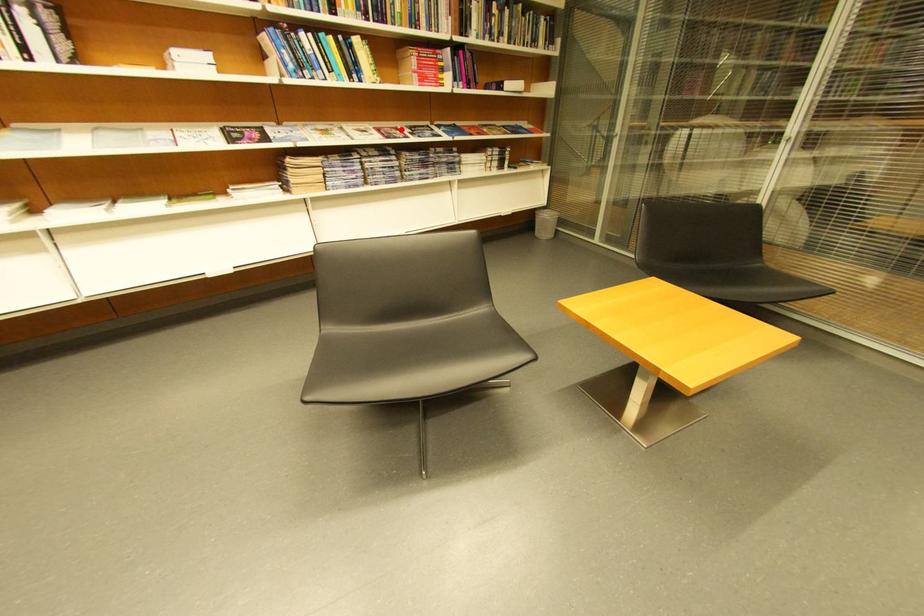
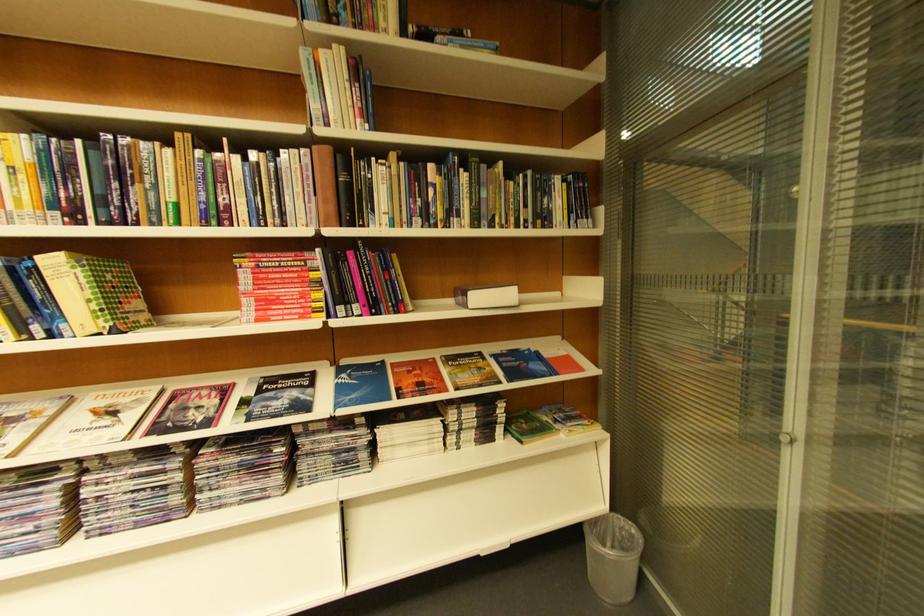
The point at the highlighted location is marked in the first image. Where is the corresponding point in the second image?

(224, 389)